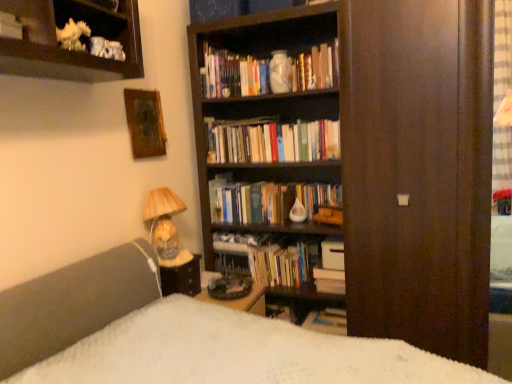
Where is `brown wood screen door at center`? The height and width of the screenshot is (384, 512). brown wood screen door at center is located at coordinates (418, 171).

Describe the element at coordinates (329, 280) in the screenshot. I see `hardcover books at center, the fifth book from the top` at that location.

What is the approximate height of hardcover books at center, arranged as the 5th book when ordered from the bottom?

The height of hardcover books at center, arranged as the 5th book when ordered from the bottom, is 9.10 inches.

Image resolution: width=512 pixels, height=384 pixels. Find the location of `wooden picture frame at upper left`. wooden picture frame at upper left is located at coordinates (145, 123).

Is hardcover book at center, positioned as the 6th book in top-to-bottom order, completely or partially inside hardcover books at center, arranged as the fourth book when viewed from the top?

No.

Considering the sizes of objects hardcover books at center, the third book in the bottom-to-top sequence, and hardcover book at center, which ranks as the 1th book in bottom-to-top order, in the image provided, who is shorter, hardcover books at center, the third book in the bottom-to-top sequence, or hardcover book at center, which ranks as the 1th book in bottom-to-top order,?

Standing shorter between the two is hardcover book at center, which ranks as the 1th book in bottom-to-top order.

From the image's perspective, which one is positioned lower, hardcover books at center, the third book in the bottom-to-top sequence, or hardcover book at center, positioned as the 6th book in top-to-bottom order?

hardcover book at center, positioned as the 6th book in top-to-bottom order.

Does hardcover books at center, arranged as the fourth book when viewed from the top, appear on the left side of hardcover book at center, which ranks as the 1th book in bottom-to-top order?

Yes.

Between matte brown table at lower left and hardcover books at upper center, which ranks as the 1th book in top-to-bottom order, which one has larger size?

hardcover books at upper center, which ranks as the 1th book in top-to-bottom order.

From a real-world perspective, is matte brown table at lower left positioned above or below hardcover books at upper center, which ranks as the 1th book in top-to-bottom order?

matte brown table at lower left is situated lower than hardcover books at upper center, which ranks as the 1th book in top-to-bottom order, in the real world.

I want to click on table that appears on the left of hardcover books at upper center, which is the 6th book in bottom-to-top order, so click(x=182, y=278).

Between point (177, 268) and point (209, 88), which one is positioned behind?

Positioned behind is point (209, 88).

In the scene shown: Which object is positioned more to the right, wooden desk at center or white matte book at lower center, marked as the 3th book in a top-to-bottom arrangement?

From the viewer's perspective, white matte book at lower center, marked as the 3th book in a top-to-bottom arrangement, appears more on the right side.

Between wooden desk at center and white matte book at lower center, marked as the 3th book in a top-to-bottom arrangement, which one has more height?

With more height is white matte book at lower center, marked as the 3th book in a top-to-bottom arrangement.

From the image's perspective, is wooden desk at center located above or below white matte book at lower center, marked as the fourth book in a bottom-to-top arrangement?

Clearly, from the image's perspective, wooden desk at center is below white matte book at lower center, marked as the fourth book in a bottom-to-top arrangement.

Does point (207, 275) appear closer or farther from the camera than point (343, 316)?

Point (207, 275) is positioned farther from the camera compared to point (343, 316).

Can you tell me how much wooden desk at center and hardcover book at center, which ranks as the 1th book in bottom-to-top order, differ in facing direction?

The angular difference between wooden desk at center and hardcover book at center, which ranks as the 1th book in bottom-to-top order, is 89.5 degrees.

Looking at this image, is wooden desk at center oriented away from hardcover book at center, positioned as the 6th book in top-to-bottom order?

No, wooden desk at center is not facing away from hardcover book at center, positioned as the 6th book in top-to-bottom order.

Is hardcover book at center, positioned as the 6th book in top-to-bottom order, a part of wooden desk at center?

Actually, hardcover book at center, positioned as the 6th book in top-to-bottom order, is outside wooden desk at center.

Between brown wood screen door at center and wooden picture frame at upper left, which one has smaller size?

With smaller size is wooden picture frame at upper left.

Considering the relative sizes of brown wood screen door at center and wooden picture frame at upper left in the image provided, is brown wood screen door at center wider than wooden picture frame at upper left?

Yes.

From a real-world perspective, is brown wood screen door at center physically below wooden picture frame at upper left?

Yes, from a real-world perspective, brown wood screen door at center is beneath wooden picture frame at upper left.

Find the location of `picture frame lying behind the brown wood screen door at center`. picture frame lying behind the brown wood screen door at center is located at coordinates (145, 123).

Which is further, (258, 94) or (129, 123)?

Point (258, 94)

Who is taller, hardcover books at upper center, which is the 6th book in bottom-to-top order, or wooden picture frame at upper left?

With more height is wooden picture frame at upper left.

From a real-world perspective, who is located higher, hardcover books at upper center, which ranks as the 1th book in top-to-bottom order, or wooden picture frame at upper left?

In real-world perspective, hardcover books at upper center, which ranks as the 1th book in top-to-bottom order, is above.

Does hardcover books at upper center, which is the 6th book in bottom-to-top order, turn towards wooden picture frame at upper left?

Yes, hardcover books at upper center, which is the 6th book in bottom-to-top order, faces towards wooden picture frame at upper left.

Is point (332, 245) positioned after point (338, 282)?

Yes, point (332, 245) is behind point (338, 282).

Which object is wider, white matte book at lower center, marked as the 3th book in a top-to-bottom arrangement, or hardcover books at center, arranged as the second book when ordered from the bottom?

Wider between the two is white matte book at lower center, marked as the 3th book in a top-to-bottom arrangement.

The image size is (512, 384). What are the coordinates of `the 2nd book below the white matte book at lower center, marked as the 3th book in a top-to-bottom arrangement (from the image's perspective)` in the screenshot? It's located at (329, 280).

Is white matte book at lower center, marked as the 3th book in a top-to-bottom arrangement, completely or partially outside of hardcover books at center, the fifth book from the top?

That's correct, white matte book at lower center, marked as the 3th book in a top-to-bottom arrangement, is outside of hardcover books at center, the fifth book from the top.

I want to click on the 2nd book behind the hardcover book at center, which ranks as the 1th book in bottom-to-top order, so click(x=279, y=265).

The height and width of the screenshot is (384, 512). In order to click on the 3rd book directly above the matte brown table at lower left (from a real-world perspective) in this screenshot , I will do pyautogui.click(x=233, y=74).

Considering their positions, is matte ceramic lamp at lower left positioned further to hardcover books at center, the third book in the bottom-to-top sequence, than hardcover books at upper center, which ranks as the 1th book in top-to-bottom order?

hardcover books at upper center, which ranks as the 1th book in top-to-bottom order, is positioned further to the anchor hardcover books at center, the third book in the bottom-to-top sequence.

When comparing their distances from hardcover books at center, the third book in the bottom-to-top sequence, does white matte book at lower center, marked as the 3th book in a top-to-bottom arrangement, or matte ceramic lamp at lower left seem closer?

white matte book at lower center, marked as the 3th book in a top-to-bottom arrangement, lies closer to hardcover books at center, the third book in the bottom-to-top sequence, than the other object.

Based on their spatial positions, is hardcover books at center, arranged as the second book when ordered from the bottom, or white matte book at lower center, marked as the fourth book in a bottom-to-top arrangement, further from hardcover books at center, arranged as the 5th book when ordered from the bottom?

hardcover books at center, arranged as the second book when ordered from the bottom, is positioned further to the anchor hardcover books at center, arranged as the 5th book when ordered from the bottom.

Considering their positions, is hardcover books at center, arranged as the 5th book when ordered from the bottom, positioned closer to porcelain vase at upper center than wooden picture frame at upper left?

hardcover books at center, arranged as the 5th book when ordered from the bottom, is closer to porcelain vase at upper center.

Estimate the real-world distances between objects in this image. Which object is further from hardcover books at center, the third book in the bottom-to-top sequence, brown wood screen door at center or hardcover books at upper center, which ranks as the 1th book in top-to-bottom order?

hardcover books at upper center, which ranks as the 1th book in top-to-bottom order, lies further to hardcover books at center, the third book in the bottom-to-top sequence, than the other object.

When comparing their distances from matte ceramic lamp at lower left, does wooden picture frame at upper left or brown wood screen door at center seem closer?

wooden picture frame at upper left is closer to matte ceramic lamp at lower left.

In the scene shown: Looking at the image, which one is located further to hardcover books at upper center, which ranks as the 1th book in top-to-bottom order, matte ceramic lamp at lower left or white matte book at lower center, marked as the fourth book in a bottom-to-top arrangement?

Among the two, white matte book at lower center, marked as the fourth book in a bottom-to-top arrangement, is located further to hardcover books at upper center, which ranks as the 1th book in top-to-bottom order.

Which object lies further to the anchor point matte brown table at lower left, hardcover books at center, arranged as the second book when ordered from the bottom, or hardcover books at center, arranged as the fourth book when viewed from the top?

hardcover books at center, arranged as the second book when ordered from the bottom, lies further to matte brown table at lower left than the other object.

This screenshot has height=384, width=512. In order to click on desk located between matte brown table at lower left and brown wood screen door at center in the left-right direction in this screenshot , I will do `click(240, 300)`.

Locate an element on the screen. The image size is (512, 384). desk between brown wood screen door at center and hardcover books at center, arranged as the second book when ordered from the bottom, from front to back is located at coordinates (240, 300).

Where is `vase between matte ceramic lamp at lower left and brown wood screen door at center`? This screenshot has width=512, height=384. vase between matte ceramic lamp at lower left and brown wood screen door at center is located at coordinates (280, 72).

Locate an element on the screen. This screenshot has height=384, width=512. lamp that lies between porcelain vase at upper center and hardcover book at center, which ranks as the 1th book in bottom-to-top order, from top to bottom is located at coordinates (163, 221).